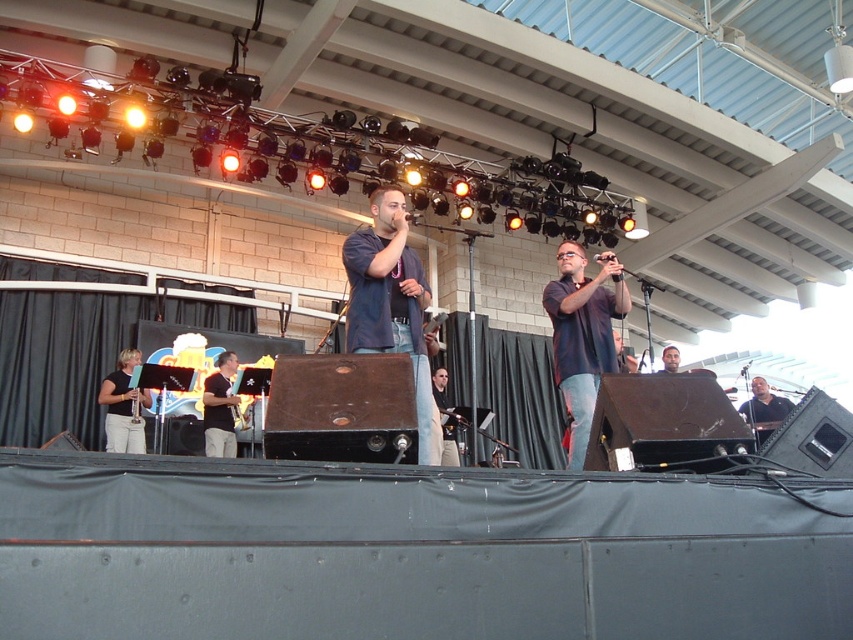
At what (x,y) coordinates should I click in order to perform the action: click on smooth skin face at center. Please return your answer as a coordinate pair (x, y). The height and width of the screenshot is (640, 853). Looking at the image, I should click on (670, 358).

Does smooth skin face at center appear on the left side of black plastic microphone at center?

Incorrect, smooth skin face at center is not on the left side of black plastic microphone at center.

Which is behind, point (677, 362) or point (602, 253)?

Positioned behind is point (677, 362).

The height and width of the screenshot is (640, 853). I want to click on smooth skin face at center, so click(x=670, y=358).

Does black matte microphone at center have a greater height compared to smooth skin face at center?

Indeed, black matte microphone at center has a greater height compared to smooth skin face at center.

Can you confirm if black matte microphone at center is positioned to the right of smooth skin face at center?

Yes, black matte microphone at center is to the right of smooth skin face at center.

Where is `black matte microphone at center`? black matte microphone at center is located at coordinates coord(764,408).

Does light brown wood saxophone at center appear on the left side of black plastic microphone at center?

Correct, you'll find light brown wood saxophone at center to the left of black plastic microphone at center.

The height and width of the screenshot is (640, 853). In order to click on light brown wood saxophone at center in this screenshot , I will do `click(219, 406)`.

You are a GUI agent. You are given a task and a screenshot of the screen. Output one action in this format:
    pyautogui.click(x=<x>, y=<y>)
    Task: Click on the light brown wood saxophone at center
    
    Given the screenshot: What is the action you would take?
    pyautogui.click(x=219, y=406)